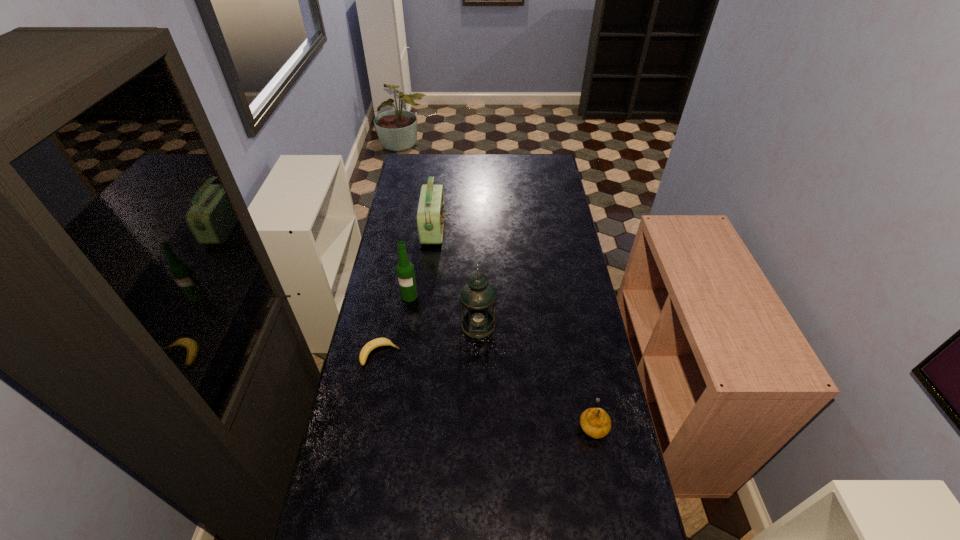
You are a GUI agent. You are given a task and a screenshot of the screen. Output one action in this format:
    pyautogui.click(x=<x>, y=<y>)
    Task: Click on the vacant space located 0.350m on the left of the second object from right to left
    The height and width of the screenshot is (540, 960).
    Given the screenshot: What is the action you would take?
    point(367,325)

I want to click on vacant region located on the label of the fourth nearest object, so click(x=398, y=365).

In order to click on vacant space situated on the front panel of the third tallest object in this screenshot , I will do pos(458,230).

At what (x,y) coordinates should I click in order to perform the action: click on free location located on the left of the fourth tallest object. Please return your answer as a coordinate pair (x, y). Image resolution: width=960 pixels, height=540 pixels. Looking at the image, I should click on (519, 424).

This screenshot has height=540, width=960. Find the location of `free region located on the right of the banana`. free region located on the right of the banana is located at coordinates (502, 354).

I want to click on beer bottle located at the left edge, so click(x=405, y=270).

This screenshot has width=960, height=540. I want to click on radio receiver at the left edge, so click(x=431, y=208).

This screenshot has height=540, width=960. In order to click on banana located in the left edge section of the desktop in this screenshot , I will do `click(378, 342)`.

Where is `object at the right edge`? The height and width of the screenshot is (540, 960). object at the right edge is located at coordinates (595, 422).

In the image, there is a desktop. Where is `vacant space at the far edge`? The width and height of the screenshot is (960, 540). vacant space at the far edge is located at coordinates (459, 161).